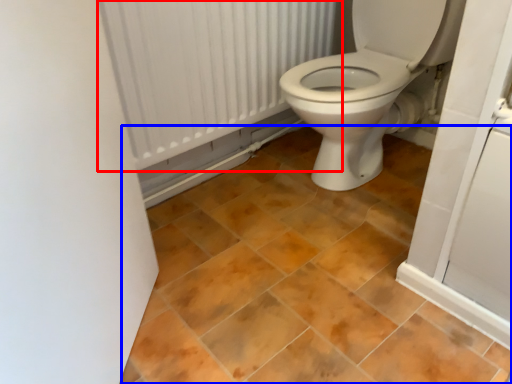
Question: Among these objects, which one is farthest to the camera, radiator (highlighted by a red box) or ceramic tile (highlighted by a blue box)?

Choices:
 (A) radiator
 (B) ceramic tile

Answer: (A)